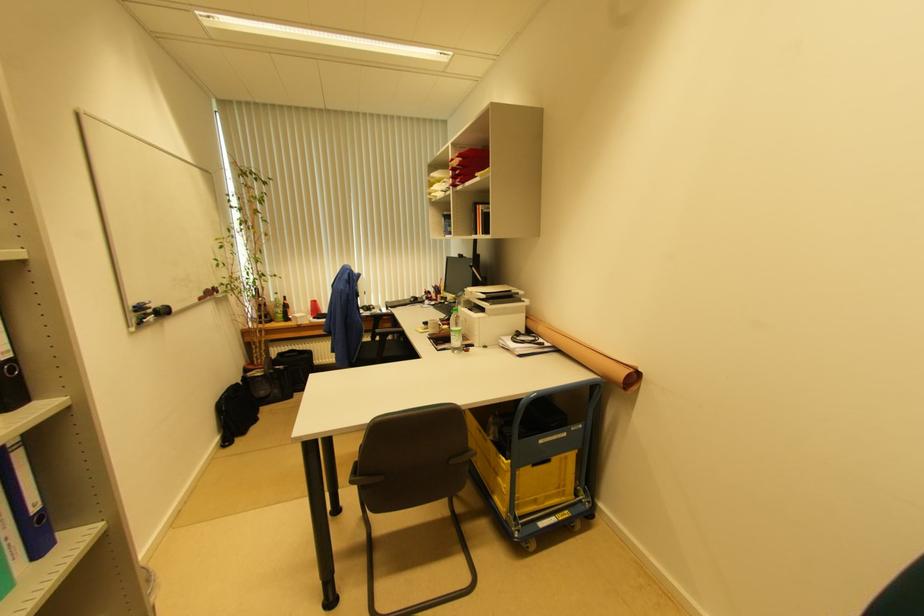
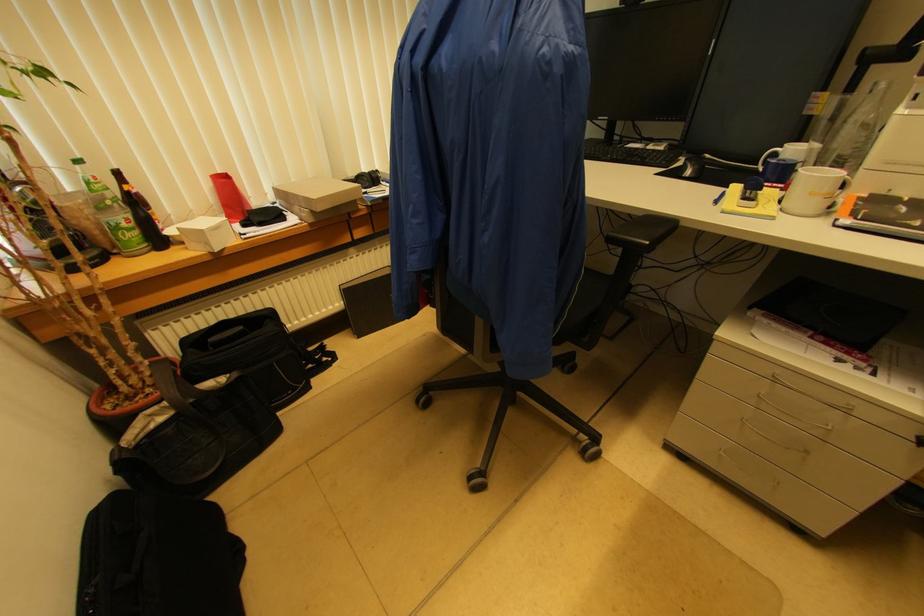
Locate, in the second image, the point that corresponds to pixel 286 300 in the first image.

(118, 176)